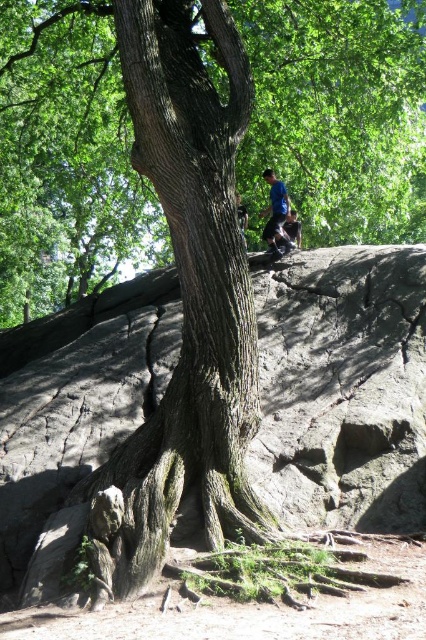
Between point (253, 310) and point (288, 211), which one is positioned behind?

Point (288, 211)

Describe the element at coordinates (195, 262) in the screenshot. This screenshot has width=426, height=640. I see `rough bark tree trunk at center` at that location.

Where is `rough bark tree trunk at center`? This screenshot has height=640, width=426. rough bark tree trunk at center is located at coordinates (195, 262).